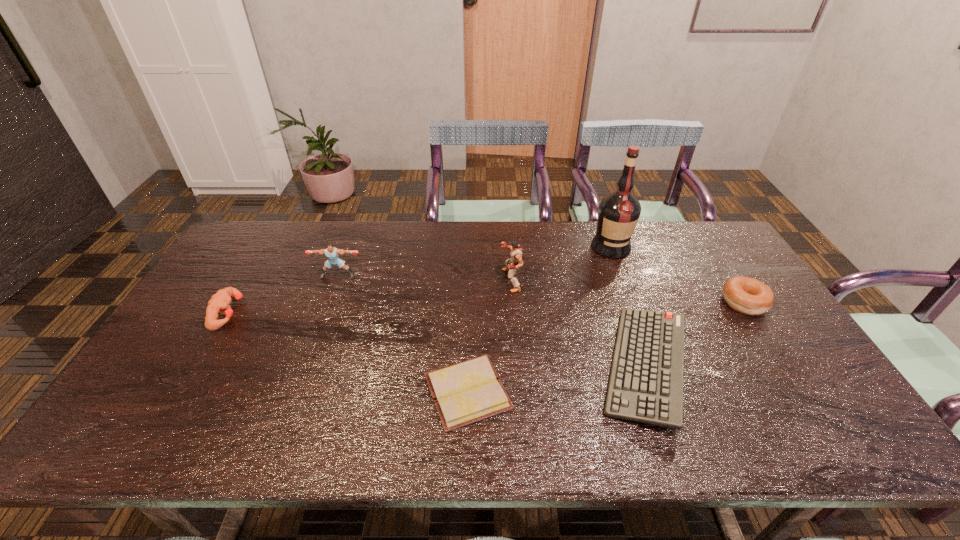
Where is `object that is at the far edge`? The width and height of the screenshot is (960, 540). object that is at the far edge is located at coordinates (618, 213).

I want to click on computer keyboard that is positioned at the near edge, so pyautogui.click(x=646, y=381).

Locate an element on the screen. This screenshot has width=960, height=540. diary situated at the near edge is located at coordinates (463, 393).

You are a GUI agent. You are given a task and a screenshot of the screen. Output one action in this format:
    pyautogui.click(x=<x>, y=<y>)
    Task: Click on the object that is at the left edge
    Image resolution: width=960 pixels, height=540 pixels.
    Given the screenshot: What is the action you would take?
    pyautogui.click(x=219, y=303)

Locate an element on the screen. The width and height of the screenshot is (960, 540). object located at the right edge is located at coordinates (749, 296).

Identify the location of free space at the far edge of the desktop. Image resolution: width=960 pixels, height=540 pixels. (423, 222).

The image size is (960, 540). What are the coordinates of `vacant region at the near edge of the desktop` in the screenshot? It's located at click(x=219, y=443).

Locate an element on the screen. Image resolution: width=960 pixels, height=540 pixels. vacant area at the left edge of the desktop is located at coordinates (146, 373).

I want to click on blank space at the right edge, so click(728, 324).

Where is `vacant space at the far left corner`? The image size is (960, 540). vacant space at the far left corner is located at coordinates (281, 233).